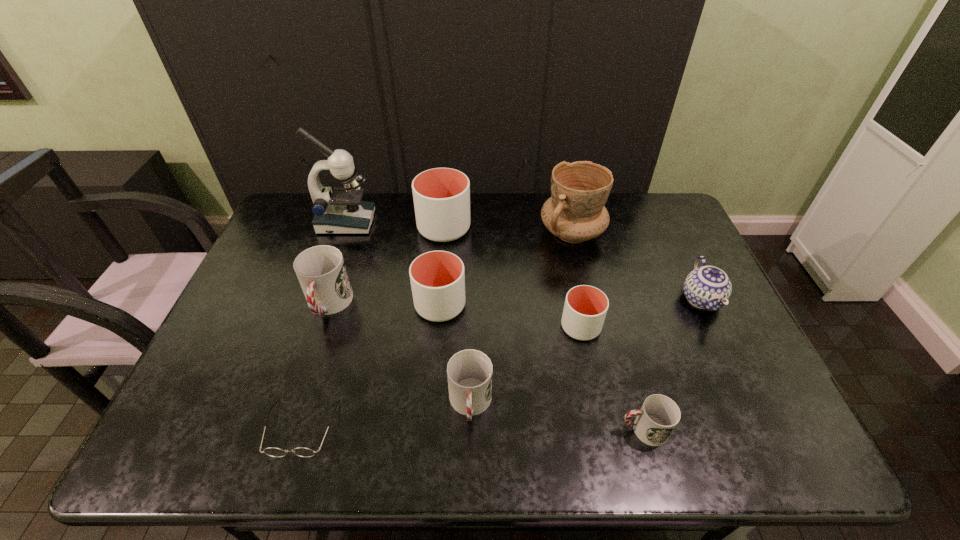
Where is `the second red cup from left to right`? Image resolution: width=960 pixels, height=540 pixels. the second red cup from left to right is located at coordinates (469, 372).

Where is `the smallest white cup`? The image size is (960, 540). the smallest white cup is located at coordinates (585, 308).

Locate an element on the screen. Image resolution: width=960 pixels, height=540 pixels. the smallest red cup is located at coordinates (659, 415).

At what (x,y) coordinates should I click in order to perform the action: click on the ninth tallest object. Please return your answer as a coordinate pair (x, y). The image size is (960, 540). Looking at the image, I should click on (659, 415).

Where is `spectacles`? Image resolution: width=960 pixels, height=540 pixels. spectacles is located at coordinates (271, 451).

The width and height of the screenshot is (960, 540). Find the location of `the shortest object`. the shortest object is located at coordinates (271, 451).

Where is `free space located at the eyepiece of the microscope`? free space located at the eyepiece of the microscope is located at coordinates (394, 222).

The width and height of the screenshot is (960, 540). Identify the location of vacant area situated on the front of the pottery. (591, 319).

At what (x,y) coordinates should I click in order to perform the action: click on vacant point located on the left of the tallest cup. Please return your answer as a coordinate pair (x, y). This screenshot has height=540, width=960. Looking at the image, I should click on (x=388, y=228).

Identify the location of free space located 0.110m on the side of the biggest red cup where the handle is located. This screenshot has height=540, width=960. pyautogui.click(x=309, y=365).